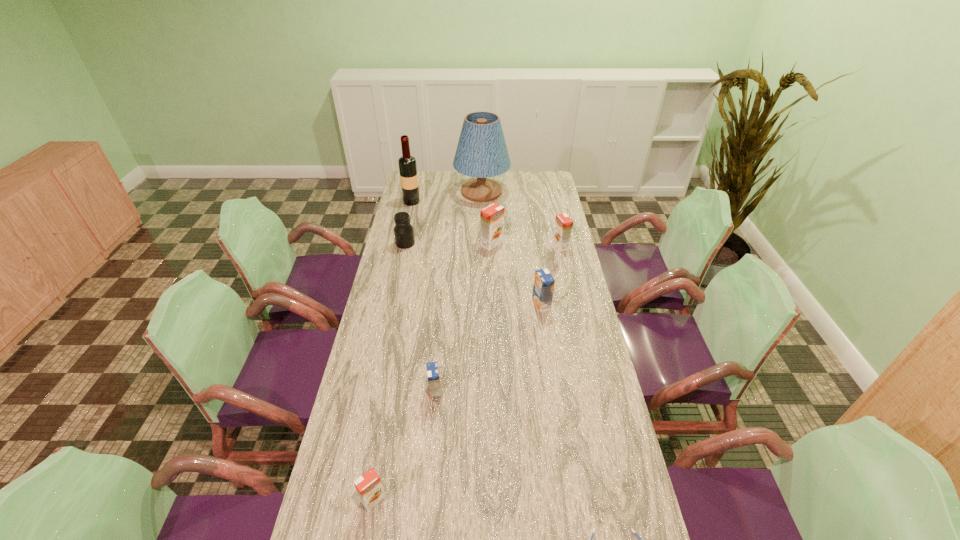
Find the location of a particular element. blue lampshade is located at coordinates (481, 152).

The height and width of the screenshot is (540, 960). Identify the location of wine bottle. (407, 164).

Image resolution: width=960 pixels, height=540 pixels. Find the location of `the biggest orange orange juice`. the biggest orange orange juice is located at coordinates (491, 217).

You are a GUI agent. You are given a task and a screenshot of the screen. Output one action in this format:
    pyautogui.click(x=<x>, y=<y>)
    Task: Click on the third orange juice from right to left
    
    Given the screenshot: What is the action you would take?
    pyautogui.click(x=491, y=217)

Where is `jar`? jar is located at coordinates (403, 231).

Locate an element on the screen. the third farthest orange juice is located at coordinates (543, 288).

Locate an element on the screen. the farther blue orange_juice is located at coordinates (543, 288).

I want to click on the rightmost orange orange juice, so click(x=563, y=223).

At what (x,y) coordinates should I click in order to perform the action: click on the second biggest orange orange juice. Please return your answer as a coordinate pair (x, y). This screenshot has width=960, height=540. Looking at the image, I should click on (563, 223).

Where is `the fourth orange juice from right to left`? Image resolution: width=960 pixels, height=540 pixels. the fourth orange juice from right to left is located at coordinates (432, 368).